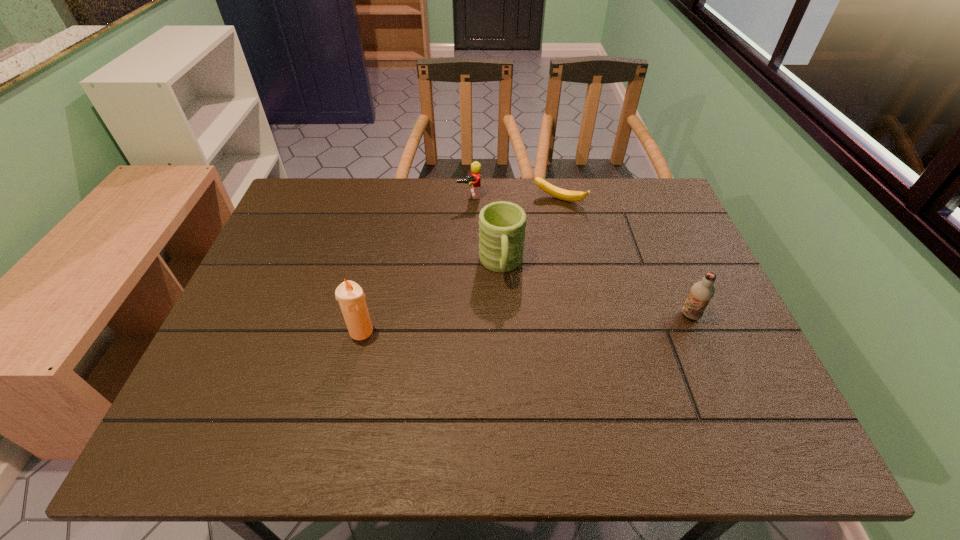
Identify the location of vacant space situated 0.220m at the stem of the banana. (530, 254).

You are a GUI agent. You are given a task and a screenshot of the screen. Output one action in this format:
    pyautogui.click(x=<x>, y=<y>)
    Task: Click on the vacant space located 0.300m at the stem of the banana
    The height and width of the screenshot is (540, 960).
    Given the screenshot: What is the action you would take?
    pyautogui.click(x=520, y=273)

This screenshot has width=960, height=540. I want to click on free location located 0.180m on the side of the third farthest object with the handle, so click(x=509, y=348).

Where is `vacant region located 0.130m on the side of the third farthest object with the handle`? vacant region located 0.130m on the side of the third farthest object with the handle is located at coordinates (507, 330).

Image resolution: width=960 pixels, height=540 pixels. What are the coordinates of `vacant space situated 0.090m on the side of the third farthest object with the handle` in the screenshot? It's located at (506, 316).

Identify the location of vacant space situated in front of the second shortest object with the accessory visible. (478, 228).

Where is `free point located 0.280m in front of the second shortest object with the accessory visible`? This screenshot has width=960, height=540. free point located 0.280m in front of the second shortest object with the accessory visible is located at coordinates (489, 266).

Where is `free space located in front of the second shortest object with the accessory visible`? This screenshot has width=960, height=540. free space located in front of the second shortest object with the accessory visible is located at coordinates (492, 280).

Where is `banana at the far edge`? This screenshot has width=960, height=540. banana at the far edge is located at coordinates (573, 196).

Find the location of a particular element. Lego located at the far edge is located at coordinates (474, 180).